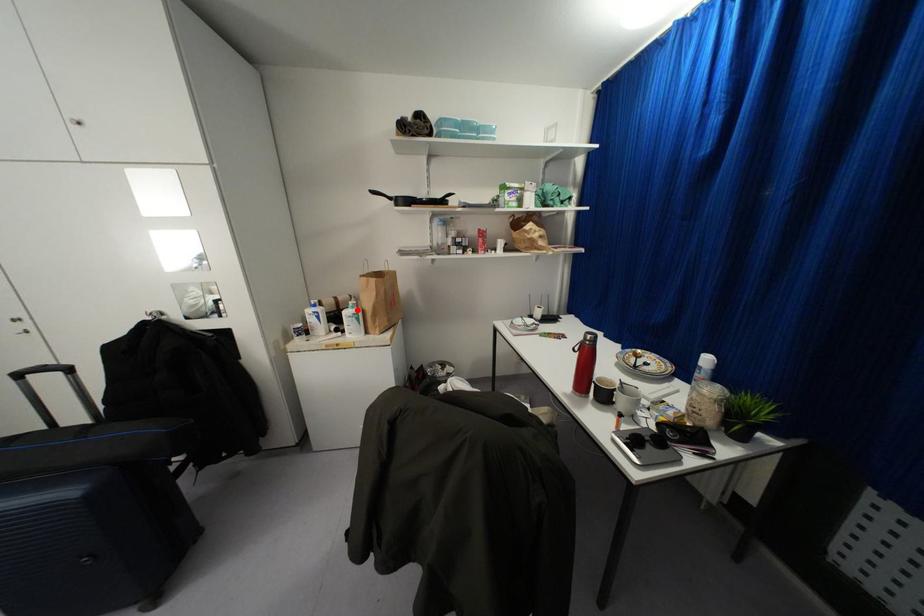
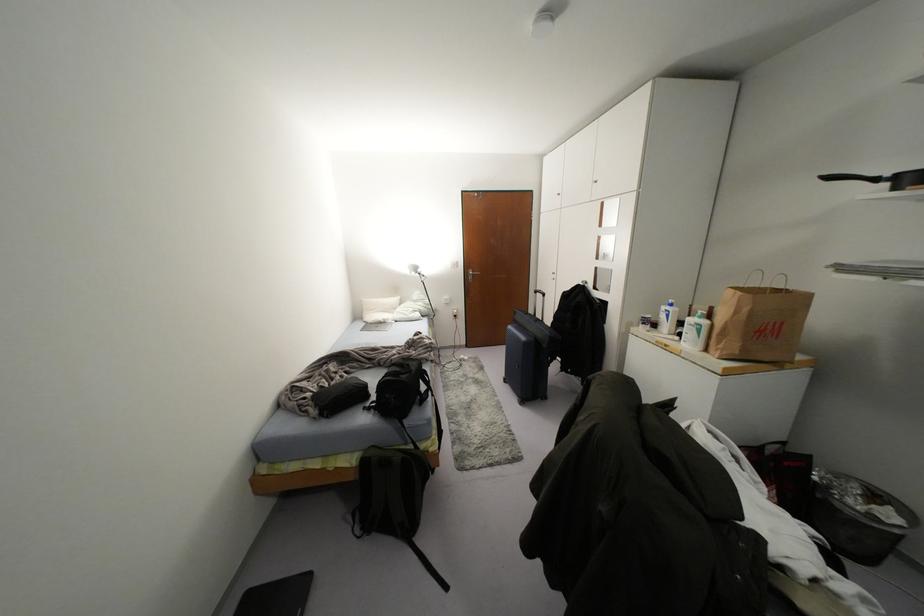
Where in the second image is the point corresponding to the highlighted location from the first image?

(703, 322)